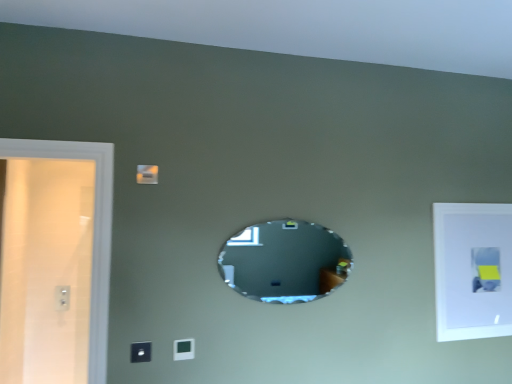
Question: Is oval mirror at center inside the boundaries of satin black switch at lower center, the first light switch from the left, or outside?

Choices:
 (A) inside
 (B) outside

Answer: (B)

Question: From a real-world perspective, relative to satin black switch at lower center, the 2th light switch from the back, is oval mirror at center vertically above or below?

Choices:
 (A) above
 (B) below

Answer: (A)

Question: Considering the real-world distances, which object is closest to the matte white light switch at lower center, positioned as the 2th light switch in front-to-back order?

Choices:
 (A) oval mirror at center
 (B) satin black switch at lower center, the 2th light switch from the back
 (C) white plastic electric outlet at left
 (D) white matte picture frame at upper right

Answer: (B)

Question: Considering the real-world distances, which object is farthest from the satin black switch at lower center, the 2th light switch from the back?

Choices:
 (A) white matte picture frame at upper right
 (B) white plastic electric outlet at left
 (C) oval mirror at center
 (D) matte white light switch at lower center, which ranks as the second light switch in left-to-right order

Answer: (B)